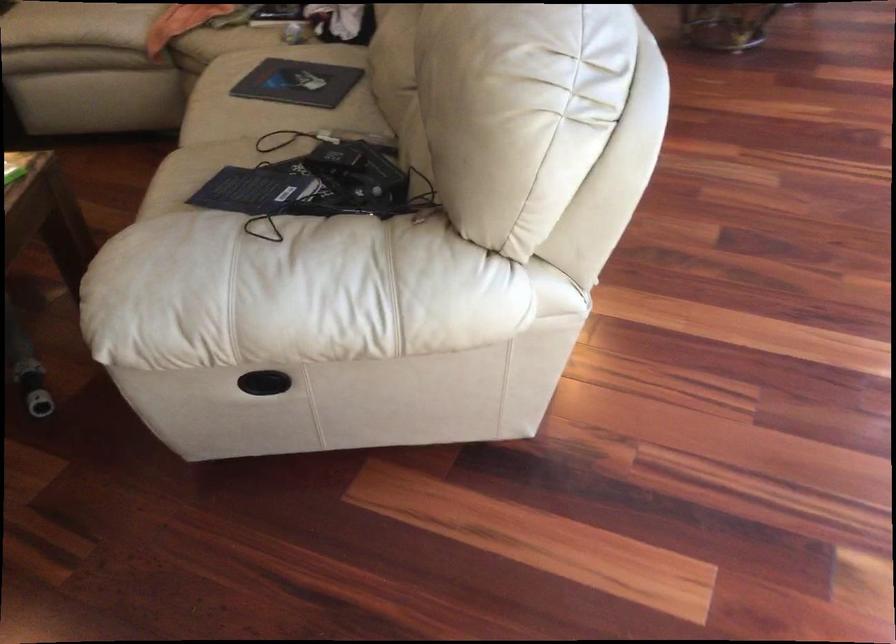
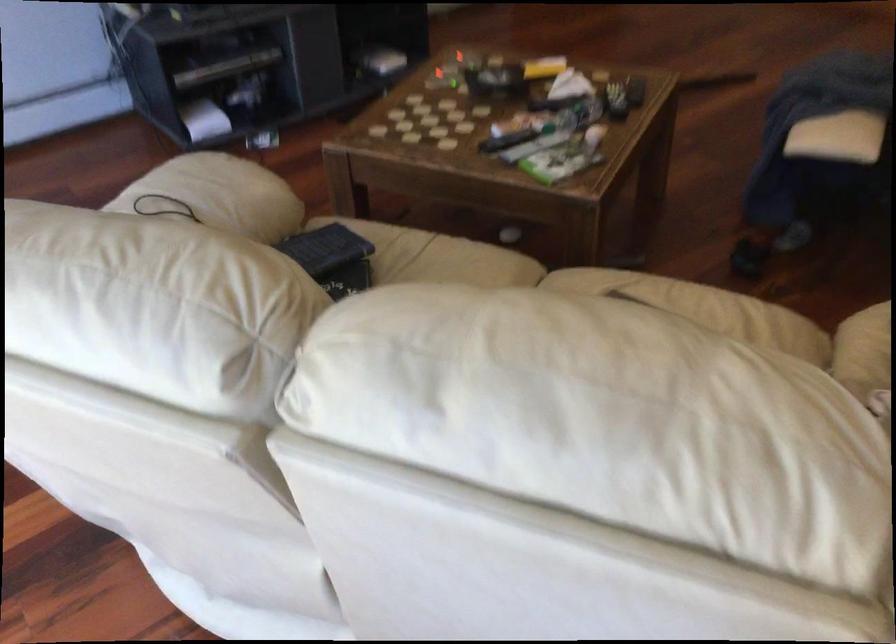
The point at (230, 102) is marked in the first image. Where is the corresponding point in the second image?

(584, 285)